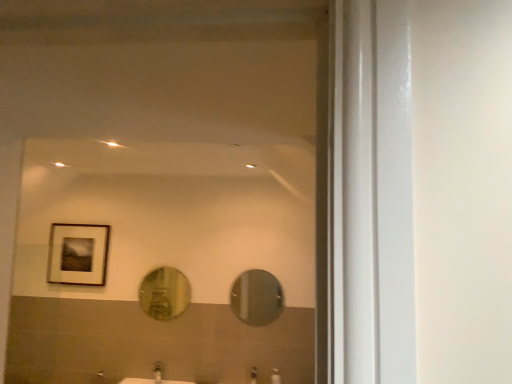
Question: In the image, is shiny metallic mirror at center, arranged as the first mirror when viewed from the right, positioned in front of or behind gold textured mirror at center, positioned as the 1th mirror in left-to-right order?

Choices:
 (A) front
 (B) behind

Answer: (A)

Question: Would you say shiny metallic mirror at center, arranged as the first mirror when viewed from the right, is to the left or to the right of gold textured mirror at center, positioned as the 1th mirror in left-to-right order, in the picture?

Choices:
 (A) left
 (B) right

Answer: (B)

Question: Estimate the real-world distances between objects in this image. Which object is closer to the gold textured mirror at center, the 2th mirror in the right-to-left sequence?

Choices:
 (A) matte silver faucet at lower center, the second faucet when ordered from right to left
 (B) matte silver faucet at lower center, positioned as the 2th faucet in left-to-right order
 (C) wooden framed picture at upper left
 (D) shiny metallic mirror at center, the second mirror when ordered from left to right

Answer: (A)

Question: Which object is the farthest from the shiny metallic mirror at center, the second mirror when ordered from left to right?

Choices:
 (A) matte silver faucet at lower center, the second faucet when ordered from right to left
 (B) wooden framed picture at upper left
 (C) gold textured mirror at center, the 2th mirror in the right-to-left sequence
 (D) matte silver faucet at lower center, positioned as the 2th faucet in left-to-right order

Answer: (B)